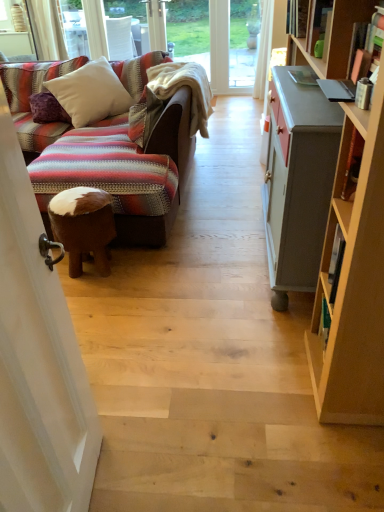
What do you see at coordinates (47, 109) in the screenshot? This screenshot has height=512, width=384. I see `purple velvet pillow at left, acting as the 2th pillow starting from the right` at bounding box center [47, 109].

This screenshot has height=512, width=384. What do you see at coordinates (83, 226) in the screenshot?
I see `brown fuzzy stool at lower left` at bounding box center [83, 226].

The height and width of the screenshot is (512, 384). I want to click on transparent glass screen door at upper left, so click(38, 360).

Could you tell me if brown fuzzy stool at lower left is turned towards white soft cushion at upper left, marked as the 2th pillow in a left-to-right arrangement?

No, brown fuzzy stool at lower left is not turned towards white soft cushion at upper left, marked as the 2th pillow in a left-to-right arrangement.

Would you say brown fuzzy stool at lower left is a long distance from white soft cushion at upper left, which ranks as the 1th pillow in right-to-left order?

Yes, brown fuzzy stool at lower left and white soft cushion at upper left, which ranks as the 1th pillow in right-to-left order, are quite far apart.

Considering the sizes of objects brown fuzzy stool at lower left and white soft cushion at upper left, marked as the 2th pillow in a left-to-right arrangement, in the image provided, who is wider, brown fuzzy stool at lower left or white soft cushion at upper left, marked as the 2th pillow in a left-to-right arrangement,?

white soft cushion at upper left, marked as the 2th pillow in a left-to-right arrangement, is wider.

Based on their positions, is brown fuzzy stool at lower left located to the left or right of white soft cushion at upper left, which ranks as the 1th pillow in right-to-left order?

From the image, it's evident that brown fuzzy stool at lower left is to the right of white soft cushion at upper left, which ranks as the 1th pillow in right-to-left order.

Choose the correct answer: Is purple velvet pillow at left, marked as the first pillow in a left-to-right arrangement, inside hardcover book at upper right or outside it?

purple velvet pillow at left, marked as the first pillow in a left-to-right arrangement, exists outside the volume of hardcover book at upper right.

Is purple velvet pillow at left, acting as the 2th pillow starting from the right, looking in the opposite direction of hardcover book at upper right?

purple velvet pillow at left, acting as the 2th pillow starting from the right, does not have its back to hardcover book at upper right.

From a real-world perspective, which is physically below, purple velvet pillow at left, marked as the first pillow in a left-to-right arrangement, or hardcover book at upper right?

purple velvet pillow at left, marked as the first pillow in a left-to-right arrangement, is physically lower.

Who is more distant, purple velvet pillow at left, marked as the first pillow in a left-to-right arrangement, or hardcover book at upper right?

purple velvet pillow at left, marked as the first pillow in a left-to-right arrangement, is more distant.

Locate an element on the screen. screen door below the hardcover book at upper right (from a real-world perspective) is located at coordinates (38, 360).

Which of these two, hardcover book at upper right or transparent glass screen door at upper left, is bigger?

transparent glass screen door at upper left.

Does hardcover book at upper right have a greater height compared to transparent glass screen door at upper left?

No, hardcover book at upper right is not taller than transparent glass screen door at upper left.

Who is taller, transparent glass screen door at upper left or hardcover book at upper right?

Standing taller between the two is transparent glass screen door at upper left.

Who is smaller, transparent glass screen door at upper left or hardcover book at upper right?

With smaller size is hardcover book at upper right.

In the scene shown: How distant is transparent glass screen door at upper left from hardcover book at upper right?

transparent glass screen door at upper left is 2.42 meters away from hardcover book at upper right.

Based on the photo, is transparent glass screen door at upper left further to the viewer compared to hardcover book at upper right?

No, transparent glass screen door at upper left is closer to the camera.

Is hardcover book at upper right inside or outside of white soft cushion at upper left, marked as the 2th pillow in a left-to-right arrangement?

hardcover book at upper right is not inside white soft cushion at upper left, marked as the 2th pillow in a left-to-right arrangement, it's outside.

From the image's perspective, would you say hardcover book at upper right is positioned over white soft cushion at upper left, marked as the 2th pillow in a left-to-right arrangement?

Yes, from the image's perspective, hardcover book at upper right is above white soft cushion at upper left, marked as the 2th pillow in a left-to-right arrangement.

Is hardcover book at upper right taller or shorter than white soft cushion at upper left, marked as the 2th pillow in a left-to-right arrangement?

Clearly, hardcover book at upper right is shorter compared to white soft cushion at upper left, marked as the 2th pillow in a left-to-right arrangement.

From the image's perspective, does white soft cushion at upper left, marked as the 2th pillow in a left-to-right arrangement, appear higher than hardcover book at upper right?

No, from the image's perspective, white soft cushion at upper left, marked as the 2th pillow in a left-to-right arrangement, is not over hardcover book at upper right.

From the hardcover book at upper right, count 1st pillows backward and point to it. Please provide its 2D coordinates.

[(90, 93)]

Is white soft cushion at upper left, which ranks as the 1th pillow in right-to-left order, facing away from hardcover book at upper right?

No, white soft cushion at upper left, which ranks as the 1th pillow in right-to-left order,'s orientation is not away from hardcover book at upper right.

From a real-world perspective, which is physically below, white soft cushion at upper left, marked as the 2th pillow in a left-to-right arrangement, or hardcover book at upper right?

white soft cushion at upper left, marked as the 2th pillow in a left-to-right arrangement, from a real-world perspective.

Is transparent glass screen door at upper left to the right of brown fuzzy stool at lower left from the viewer's perspective?

Yes.

From a real-world perspective, which object stands above the other?

transparent glass screen door at upper left, from a real-world perspective.

Is transparent glass screen door at upper left positioned behind brown fuzzy stool at lower left?

No, it is in front of brown fuzzy stool at lower left.

Between transparent glass screen door at upper left and brown fuzzy stool at lower left, which one has larger width?

With larger width is brown fuzzy stool at lower left.

Find the location of a particular element. The width and height of the screenshot is (384, 512). pillow that is the 1st one when counting backward from the brown fuzzy stool at lower left is located at coordinates (90, 93).

At what (x,y) coordinates should I click in order to perform the action: click on book positioned vertically above the purple velvet pillow at left, acting as the 2th pillow starting from the right (from a real-world perspective). Please return your answer as a coordinate pair (x, y). This screenshot has height=512, width=384. Looking at the image, I should click on (297, 17).

Based on their spatial positions, is white soft cushion at upper left, which ranks as the 1th pillow in right-to-left order, or hardcover book at upper right closer to purple velvet pillow at left, acting as the 2th pillow starting from the right?

Among the two, white soft cushion at upper left, which ranks as the 1th pillow in right-to-left order, is located nearer to purple velvet pillow at left, acting as the 2th pillow starting from the right.

Based on their spatial positions, is brown fuzzy stool at lower left or white soft cushion at upper left, which ranks as the 1th pillow in right-to-left order, closer to transparent glass screen door at upper left?

brown fuzzy stool at lower left is positioned closer to the anchor transparent glass screen door at upper left.

When comparing their distances from white soft cushion at upper left, marked as the 2th pillow in a left-to-right arrangement, does brown fuzzy stool at lower left or purple velvet pillow at left, marked as the first pillow in a left-to-right arrangement, seem closer?

The object closer to white soft cushion at upper left, marked as the 2th pillow in a left-to-right arrangement, is purple velvet pillow at left, marked as the first pillow in a left-to-right arrangement.

Estimate the real-world distances between objects in this image. Which object is closer to transparent glass screen door at upper left, white soft cushion at upper left, marked as the 2th pillow in a left-to-right arrangement, or hardcover book at upper right?

hardcover book at upper right is positioned closer to the anchor transparent glass screen door at upper left.

Estimate the real-world distances between objects in this image. Which object is closer to brown fuzzy stool at lower left, hardcover book at upper right or purple velvet pillow at left, acting as the 2th pillow starting from the right?

purple velvet pillow at left, acting as the 2th pillow starting from the right.

When comparing their distances from transparent glass screen door at upper left, does brown fuzzy stool at lower left or hardcover book at upper right seem further?

Among the two, hardcover book at upper right is located further to transparent glass screen door at upper left.

Which object lies nearer to the anchor point brown fuzzy stool at lower left, transparent glass screen door at upper left or purple velvet pillow at left, marked as the first pillow in a left-to-right arrangement?

transparent glass screen door at upper left.

When comparing their distances from transparent glass screen door at upper left, does hardcover book at upper right or white soft cushion at upper left, which ranks as the 1th pillow in right-to-left order, seem further?

white soft cushion at upper left, which ranks as the 1th pillow in right-to-left order, is positioned further to the anchor transparent glass screen door at upper left.

The width and height of the screenshot is (384, 512). In order to click on book positioned between transparent glass screen door at upper left and purple velvet pillow at left, marked as the first pillow in a left-to-right arrangement, from near to far in this screenshot , I will do `click(297, 17)`.

Identify the location of stool positioned between transparent glass screen door at upper left and white soft cushion at upper left, marked as the 2th pillow in a left-to-right arrangement, from near to far. (83, 226).

Identify the location of book located between transparent glass screen door at upper left and white soft cushion at upper left, marked as the 2th pillow in a left-to-right arrangement, in the depth direction. The image size is (384, 512). (297, 17).

Locate an element on the screen. pillow between white soft cushion at upper left, which ranks as the 1th pillow in right-to-left order, and brown fuzzy stool at lower left in the up-down direction is located at coordinates (47, 109).